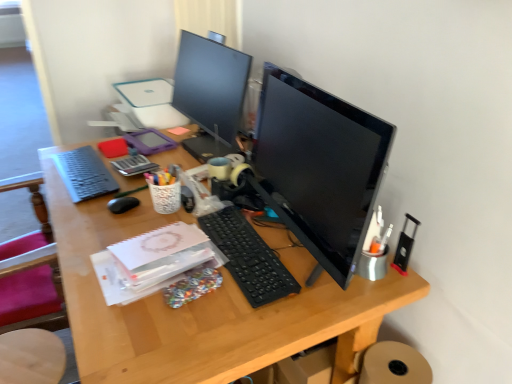
Question: Considering the positions of black matte mouse at center-left and matte black keyboard at left, which is counted as the 2th computer keyboard, starting from the right, in the image, is black matte mouse at center-left taller or shorter than matte black keyboard at left, which is counted as the 2th computer keyboard, starting from the right,?

Choices:
 (A) tall
 (B) short

Answer: (A)

Question: Considering their positions, is black matte mouse at center-left located in front of or behind matte black keyboard at left, the first computer keyboard positioned from the back?

Choices:
 (A) front
 (B) behind

Answer: (A)

Question: Estimate the real-world distances between objects in this image. Which object is farther from the black glossy monitor at upper center, arranged as the second computer monitor when viewed from the right?

Choices:
 (A) metallic black stapler at right, the 2th stationery from the left
 (B) black plastic keyboard at center, which appears as the first computer keyboard when ordered from the bottom
 (C) black glossy monitor at center, which is the second computer monitor from left to right
 (D) black matte mouse at center-left
 (E) matte black keyboard at left, positioned as the second computer keyboard in front-to-back order

Answer: (A)

Question: Which of these objects is positioned farthest from the black matte mouse at center-left?

Choices:
 (A) black plastic keyboard at center, which is counted as the 2th computer keyboard, starting from the left
 (B) metallic black stapler at right, which is the 1th stationery in right-to-left order
 (C) matte black keyboard at left, which is counted as the 2th computer keyboard, starting from the right
 (D) wooden seat at lower left
 (E) matte plastic tablet at center-left, the 1th stationery when ordered from left to right

Answer: (B)